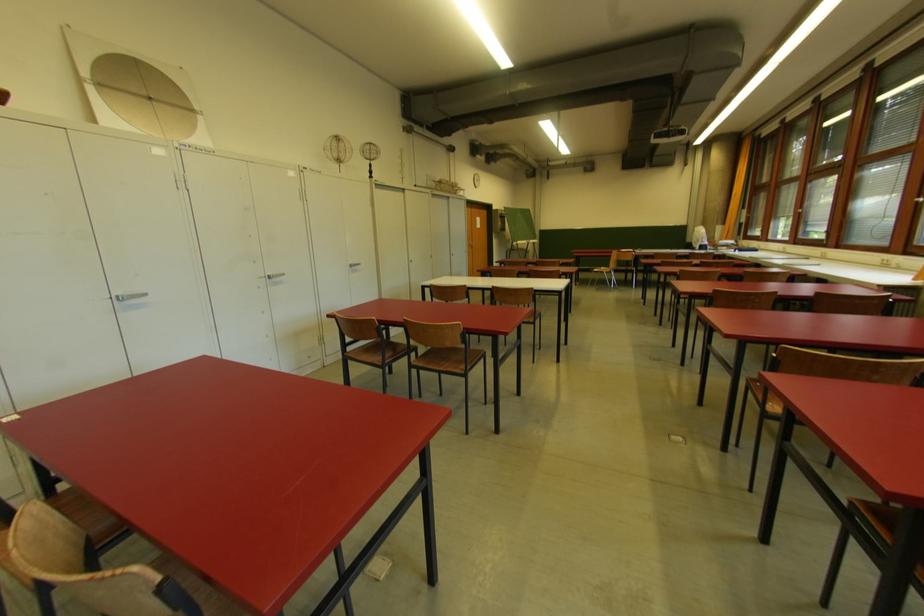
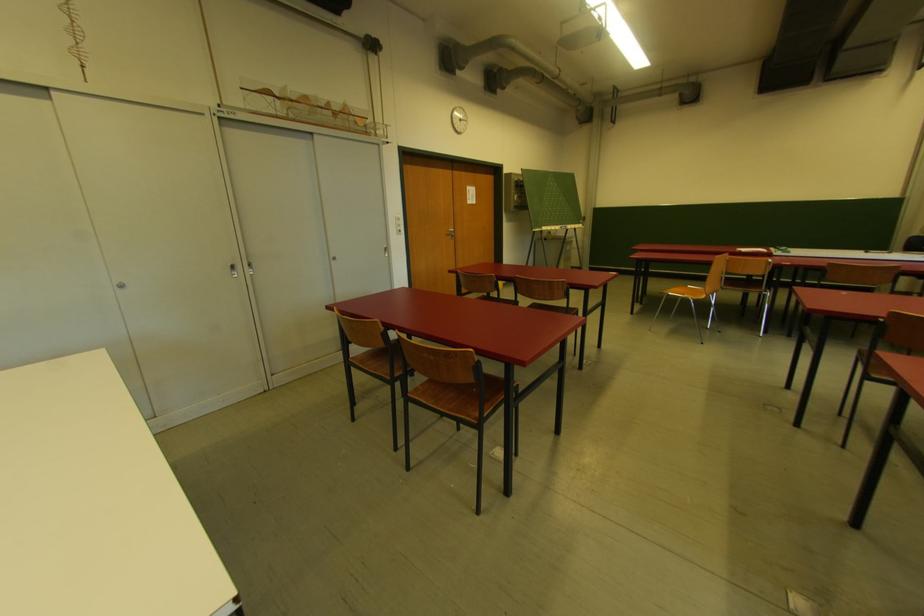
Which direction would the cameraman need to move to produce the second image?

The cameraman moved toward right, forward.